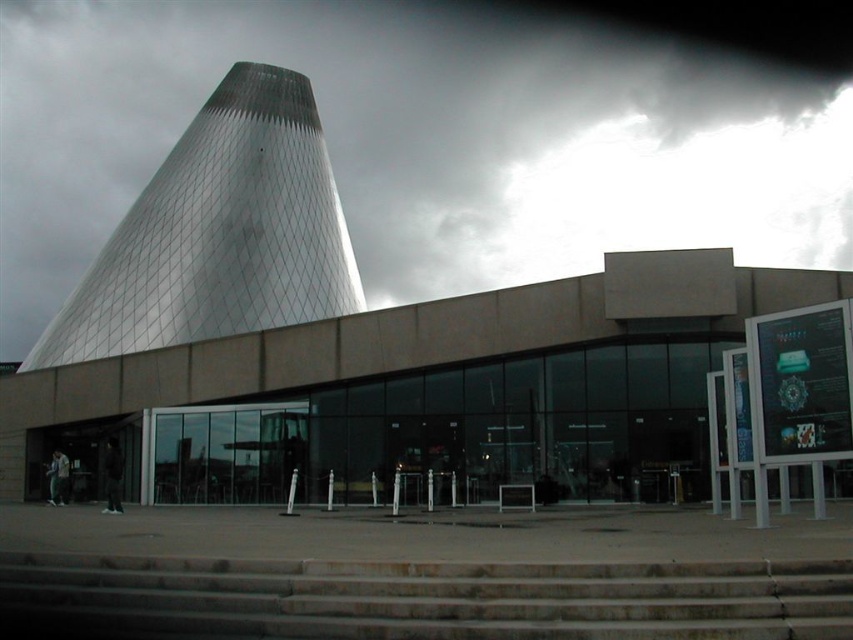
From the picture: You are an architect planning to install a new lighting system. You need to determine which object, the dark gray textured cone at upper center or the concrete stairs at center, has a greater width to decide where to place the lights. Based on the scene, which object is wider?

The dark gray textured cone at upper center is wider than the concrete stairs at center, so the lights should be placed accordingly to accommodate its larger width.

You are standing at the entrance of the building and want to go up to the second floor. The entrance has a path leading to the concrete stairs at center and the metallic glass tower at upper left. Which direction should you go to reach the stairs first?

You should go to the right because the concrete stairs at center are to the right of the metallic glass tower at upper left, so they will be encountered first in that direction.

You are standing at the entrance of the building and want to reach the main entrance doors. The concrete stairs at center are in your way. Can you go around them to reach the doors?

The concrete stairs at center are positioned at point (434, 596), so you can go around them to reach the main entrance doors.